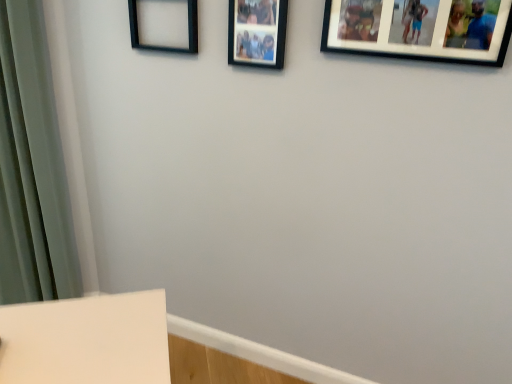
Question: Is black matte picture frame at upper left, acting as the first picture frame starting from the left, at the right side of black matte picture frame at upper center, the second picture frame from the left?

Choices:
 (A) no
 (B) yes

Answer: (A)

Question: Does black matte picture frame at upper left, acting as the first picture frame starting from the left, have a greater width compared to black matte picture frame at upper center, the 2th picture frame from the right?

Choices:
 (A) no
 (B) yes

Answer: (B)

Question: Is black matte picture frame at upper left, acting as the first picture frame starting from the left, positioned with its back to black matte picture frame at upper center, the second picture frame from the left?

Choices:
 (A) no
 (B) yes

Answer: (A)

Question: Is black matte picture frame at upper left, acting as the first picture frame starting from the left, facing towards black matte picture frame at upper center, the second picture frame from the left?

Choices:
 (A) no
 (B) yes

Answer: (A)

Question: Is black matte picture frame at upper left, acting as the first picture frame starting from the left, shorter than black matte picture frame at upper center, the 2th picture frame from the right?

Choices:
 (A) no
 (B) yes

Answer: (B)

Question: From the image's perspective, relative to black matte picture frame at upper left, the 3th picture frame when ordered from right to left, is black matte picture frame at upper center, the second picture frame from the left, above or below?

Choices:
 (A) below
 (B) above

Answer: (A)

Question: In the image, is black matte picture frame at upper center, the 2th picture frame from the right, on the left side or the right side of black matte picture frame at upper left, the 3th picture frame when ordered from right to left?

Choices:
 (A) right
 (B) left

Answer: (A)

Question: Considering the positions of black matte picture frame at upper center, the second picture frame from the left, and black matte picture frame at upper left, the 3th picture frame when ordered from right to left, in the image, is black matte picture frame at upper center, the second picture frame from the left, taller or shorter than black matte picture frame at upper left, the 3th picture frame when ordered from right to left,?

Choices:
 (A) tall
 (B) short

Answer: (A)

Question: Relative to black matte picture frame at upper left, the 3th picture frame when ordered from right to left, is black matte picture frame at upper center, the 2th picture frame from the right, in front or behind?

Choices:
 (A) front
 (B) behind

Answer: (A)

Question: From a real-world perspective, relative to black matte picture frame at upper center, the second picture frame from the left, is black matte picture frame at upper left, the 3th picture frame when ordered from right to left, vertically above or below?

Choices:
 (A) above
 (B) below

Answer: (B)

Question: In terms of height, does black matte picture frame at upper left, acting as the first picture frame starting from the left, look taller or shorter compared to black matte picture frame at upper center, the 2th picture frame from the right?

Choices:
 (A) tall
 (B) short

Answer: (B)

Question: Is point (161, 29) positioned closer to the camera than point (244, 56)?

Choices:
 (A) farther
 (B) closer

Answer: (A)

Question: Which is correct: black matte picture frame at upper left, the 3th picture frame when ordered from right to left, is inside black matte picture frame at upper center, the second picture frame from the left, or outside of it?

Choices:
 (A) inside
 (B) outside

Answer: (B)

Question: Does point (236, 57) appear closer or farther from the camera than point (378, 54)?

Choices:
 (A) farther
 (B) closer

Answer: (A)

Question: In terms of height, does black matte picture frame at upper center, the 2th picture frame from the right, look taller or shorter compared to black matte picture frame at upper right, the first picture frame when ordered from right to left?

Choices:
 (A) short
 (B) tall

Answer: (B)